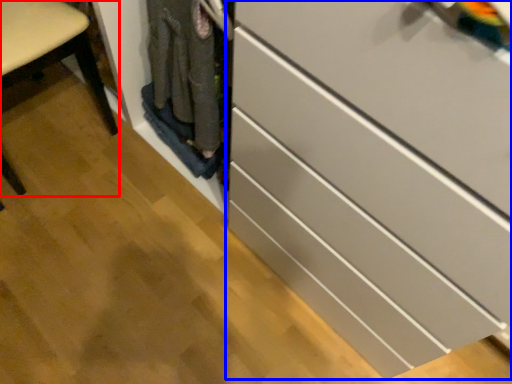
Question: Among these objects, which one is nearest to the camera, furniture (highlighted by a red box) or chest of drawers (highlighted by a blue box)?

Choices:
 (A) furniture
 (B) chest of drawers

Answer: (B)